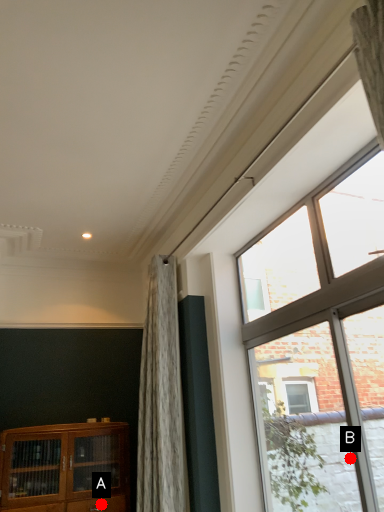
Question: Two points are circled on the image, labeled by A and B beside each circle. Which point is closer to the camera?

Choices:
 (A) A is closer
 (B) B is closer

Answer: (A)